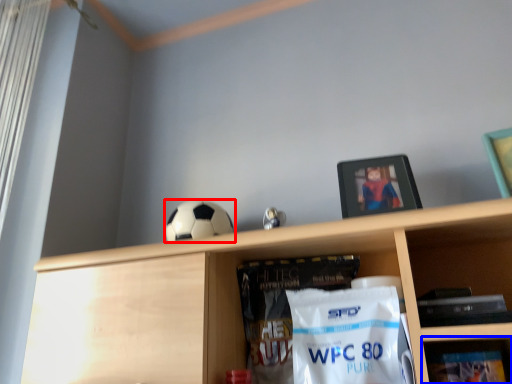
Question: Which point is closer to the camera, football (highlighted by a red box) or shelf (highlighted by a blue box)?

Choices:
 (A) football
 (B) shelf

Answer: (B)